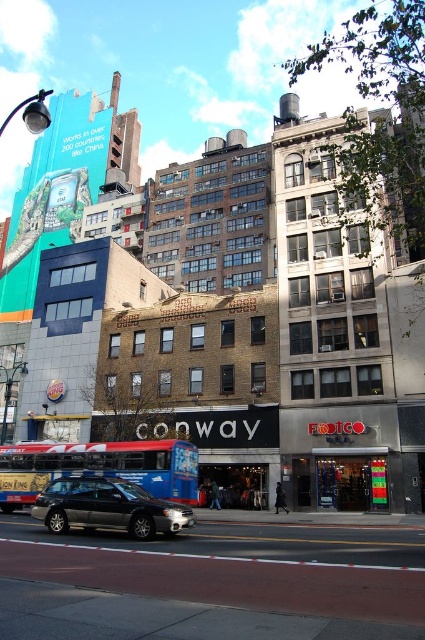
You are a pedestrian standing on the sidewalk and want to cross the street to reach the FootCo store. There is a blue metallic bus at center and a metallic gray sedan at center in your path. Which vehicle is closer to the sidewalk so you should be cautious of first?

The blue metallic bus at center is below metallic gray sedan at center, meaning it is closer to the sidewalk. You should be cautious of the blue metallic bus at center first as it is nearer to your position on the sidewalk.

You are a pedestrian standing on the sidewalk and want to cross the street to the FootCo store. There is a blue metallic bus at center and a metallic gray sedan at center in the road. Which vehicle should you wait for to pass before crossing?

You should wait for both the blue metallic bus at center and the metallic gray sedan at center to pass before crossing. Since the metallic gray sedan at center is behind the blue metallic bus at center, they are likely stopped at a traffic light or stop sign. Wait until both vehicles have come to a complete stop and it is safe to cross.